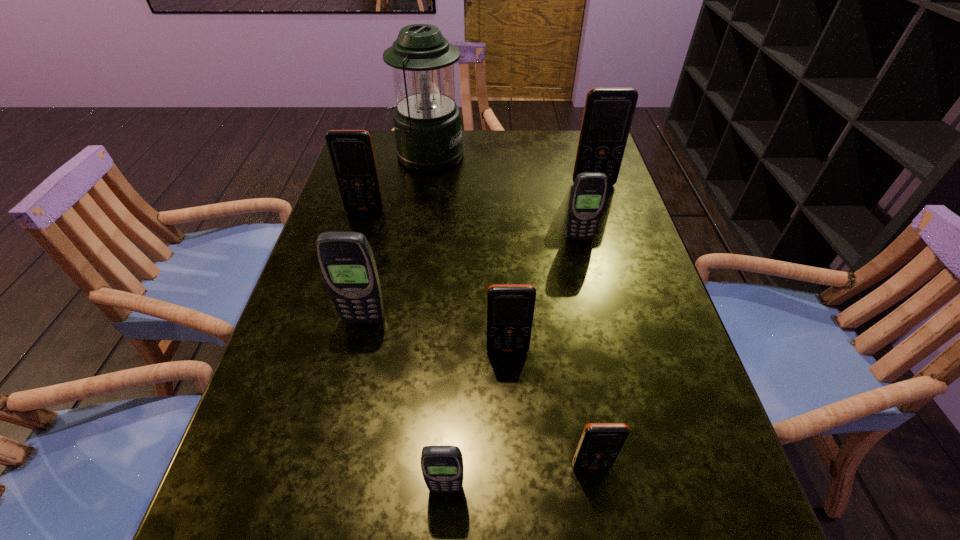
Point out which orange cellular telephone is positioned as the second nearest to the third smallest orange cellular telephone. Please provide its 2D coordinates. Your answer should be formatted as a tuple, i.e. [(x, y)], where the tuple contains the x and y coordinates of a point satisfying the conditions above.

[(608, 113)]

Where is `orange cellular telephone object that ranks as the second closest to the second farthest object`? The image size is (960, 540). orange cellular telephone object that ranks as the second closest to the second farthest object is located at coordinates (510, 307).

Choose which gray cellular telephone is the second nearest neighbor to the fifth farthest cellular telephone. Please provide its 2D coordinates. Your answer should be formatted as a tuple, i.e. [(x, y)], where the tuple contains the x and y coordinates of a point satisfying the conditions above.

[(442, 466)]

Identify which gray cellular telephone is located as the second nearest to the biggest gray cellular telephone. Please provide its 2D coordinates. Your answer should be formatted as a tuple, i.e. [(x, y)], where the tuple contains the x and y coordinates of a point satisfying the conditions above.

[(589, 191)]